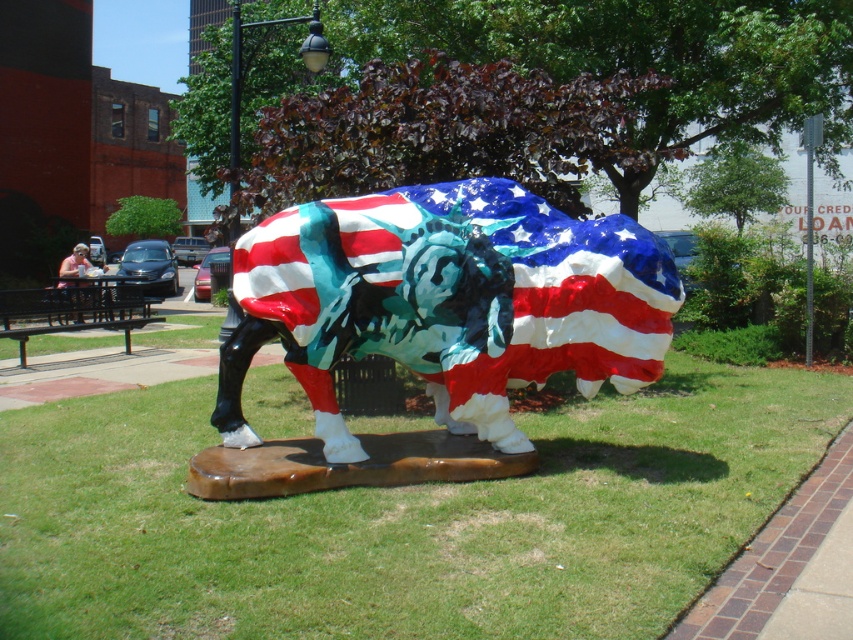
You are standing in the urban park where the American flag buffalo sculpture is located. You notice a point marked at coordinates (401, 518). What is the color of the surface at that point?

The point at coordinates (401, 518) indicates green grass at center, so the surface there is green.

You are a gardener who needs to mow the green grass at center. However, the shiny metallic bull at center is in the way. Can you move the bull to access the grass?

The green grass at center is positioned under the shiny metallic bull at center, so you cannot access the grass without moving the bull first.

You are standing in the urban park where the sculpture is located. You see the green grass at center and the shiny metallic bull at center. Which object is positioned to the left of the other?

The green grass at center is to the left of the shiny metallic bull at center.